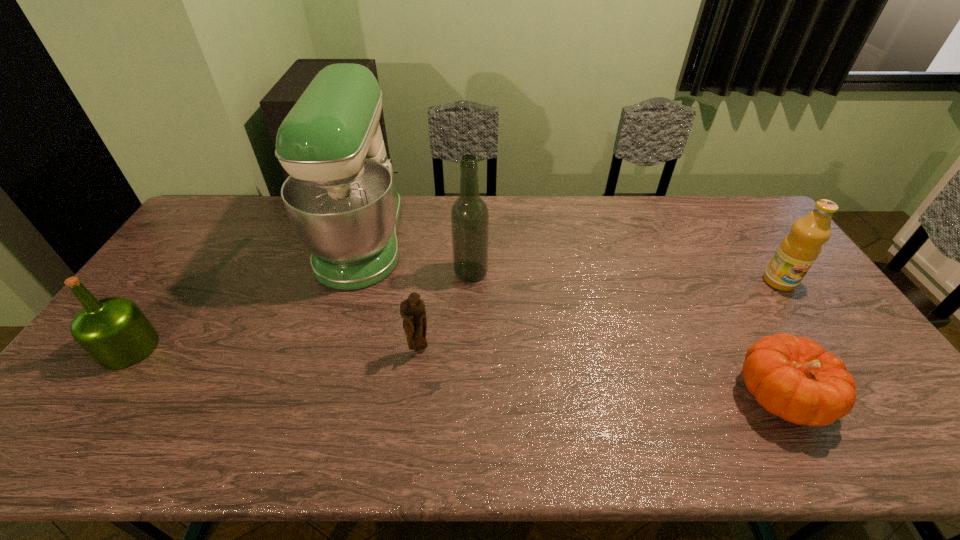
The height and width of the screenshot is (540, 960). Identify the location of object positioned at the right edge. (797, 252).

At what (x,y) coordinates should I click in order to perform the action: click on free space at the far edge of the desktop. Please return your answer as a coordinate pair (x, y). Image resolution: width=960 pixels, height=540 pixels. Looking at the image, I should click on (449, 221).

In the image, there is a desktop. At what (x,y) coordinates should I click in order to perform the action: click on free space at the left edge. Please return your answer as a coordinate pair (x, y). Looking at the image, I should click on (169, 287).

Where is `vacant space at the right edge of the desktop`? The width and height of the screenshot is (960, 540). vacant space at the right edge of the desktop is located at coordinates (751, 265).

Identify the location of blank space at the far left corner of the desktop. The image size is (960, 540). (208, 225).

Identify the location of free space at the near left corner of the desktop. The height and width of the screenshot is (540, 960). (35, 440).

Locate an element on the screen. This screenshot has height=540, width=960. vacant point at the far right corner is located at coordinates (728, 206).

Find the location of `empty space between the fourth object from left to right and the rightmost object`. empty space between the fourth object from left to right and the rightmost object is located at coordinates (625, 276).

Where is `vacant area between the rightmost object and the liquor`? This screenshot has height=540, width=960. vacant area between the rightmost object and the liquor is located at coordinates (625, 276).

Where is `vacant point located between the liquor and the figurine`? vacant point located between the liquor and the figurine is located at coordinates (445, 311).